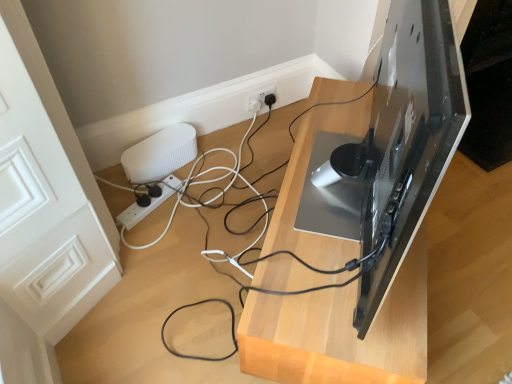
In order to click on free spot in front of white ribbed speaker at lower left in this screenshot , I will do `click(165, 208)`.